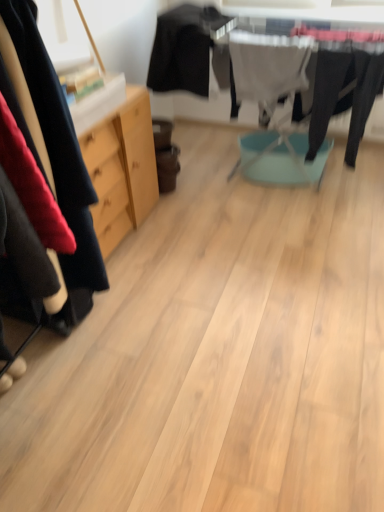
Question: Which direction should I rotate to look at white fabric at center, arranged as the second clothing when viewed from the left, — up or down?

Choices:
 (A) up
 (B) down

Answer: (A)

Question: From a real-world perspective, is white fabric at center, the first clothing when ordered from right to left, physically above black fabric at upper center, placed as the first clothing when sorted from left to right?

Choices:
 (A) no
 (B) yes

Answer: (A)

Question: Is white fabric at center, the first clothing when ordered from right to left, wider than black fabric at upper center, the second clothing positioned from the right?

Choices:
 (A) no
 (B) yes

Answer: (A)

Question: Is white fabric at center, arranged as the second clothing when viewed from the left, smaller than black fabric at upper center, placed as the first clothing when sorted from left to right?

Choices:
 (A) yes
 (B) no

Answer: (A)

Question: Is white fabric at center, the first clothing when ordered from right to left, facing away from black fabric at upper center, placed as the first clothing when sorted from left to right?

Choices:
 (A) no
 (B) yes

Answer: (A)

Question: Is white fabric at center, the first clothing when ordered from right to left, outside of black fabric at upper center, placed as the first clothing when sorted from left to right?

Choices:
 (A) yes
 (B) no

Answer: (A)

Question: Is white fabric at center, the first clothing when ordered from right to left, positioned behind black fabric at upper center, placed as the first clothing when sorted from left to right?

Choices:
 (A) yes
 (B) no

Answer: (B)

Question: From the image's perspective, is black fabric at upper center, the second clothing positioned from the right, beneath white fabric at center, the first clothing when ordered from right to left?

Choices:
 (A) no
 (B) yes

Answer: (A)

Question: Does black fabric at upper center, placed as the first clothing when sorted from left to right, have a greater height compared to white fabric at center, the first clothing when ordered from right to left?

Choices:
 (A) no
 (B) yes

Answer: (A)

Question: From a real-world perspective, is black fabric at upper center, placed as the first clothing when sorted from left to right, under white fabric at center, the first clothing when ordered from right to left?

Choices:
 (A) yes
 (B) no

Answer: (B)

Question: From a real-world perspective, is black fabric at upper center, placed as the first clothing when sorted from left to right, on white fabric at center, the first clothing when ordered from right to left?

Choices:
 (A) yes
 (B) no

Answer: (A)

Question: Does black fabric at upper center, placed as the first clothing when sorted from left to right, have a lesser width compared to white fabric at center, arranged as the second clothing when viewed from the left?

Choices:
 (A) yes
 (B) no

Answer: (B)

Question: Is black fabric at upper center, the second clothing positioned from the right, to the left of white fabric at center, the first clothing when ordered from right to left, from the viewer's perspective?

Choices:
 (A) yes
 (B) no

Answer: (A)

Question: From the image's perspective, is black fabric at upper center, placed as the first clothing when sorted from left to right, above or below white fabric at center, the first clothing when ordered from right to left?

Choices:
 (A) below
 (B) above

Answer: (B)